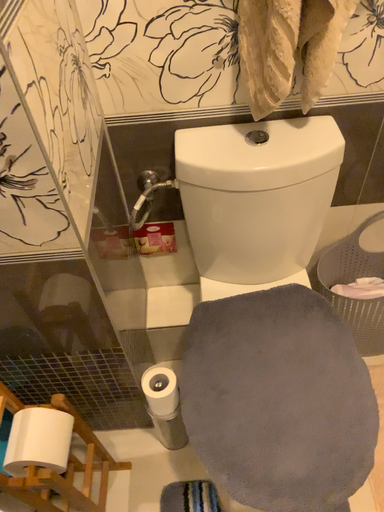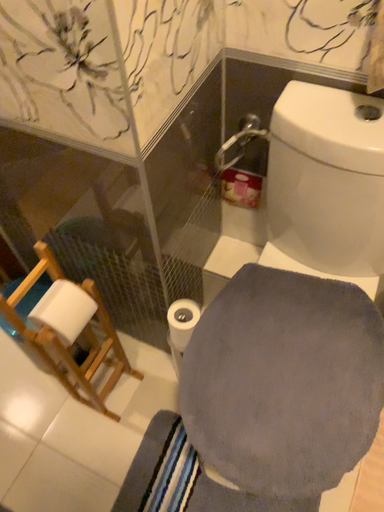
Question: How did the camera likely rotate when shooting the video?

Choices:
 (A) rotated left
 (B) rotated right

Answer: (A)